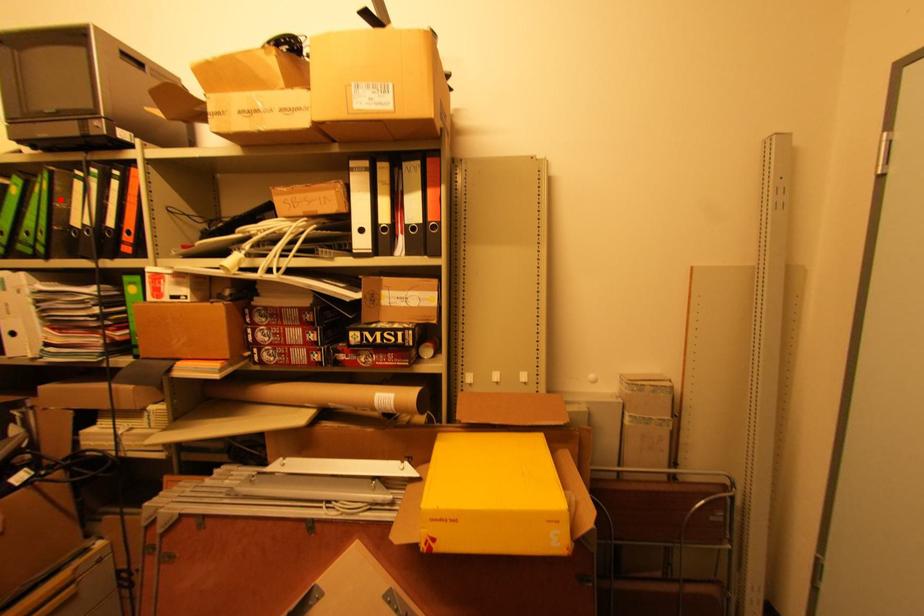
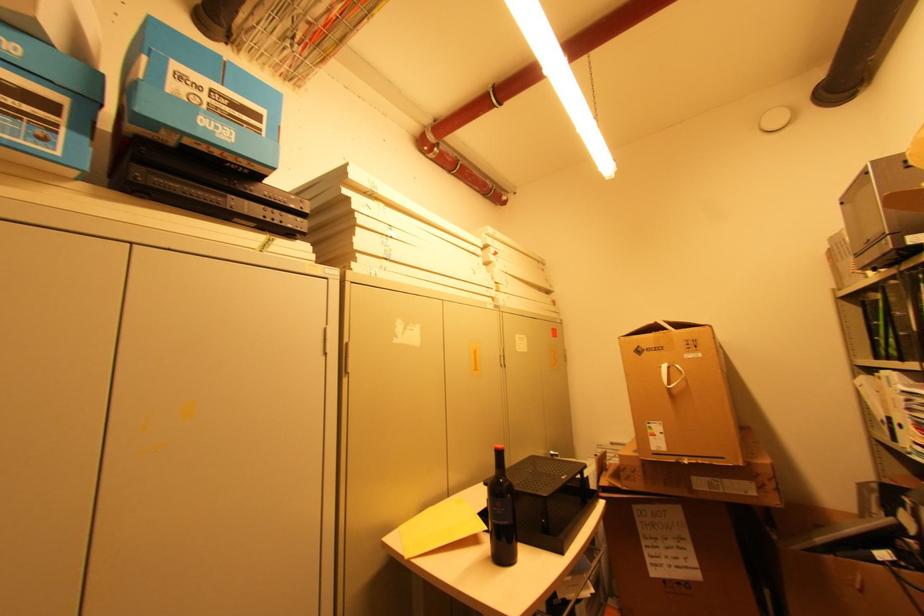
Locate, in the second image, the point that corresponds to the highlighted location in the first image.

(896, 310)